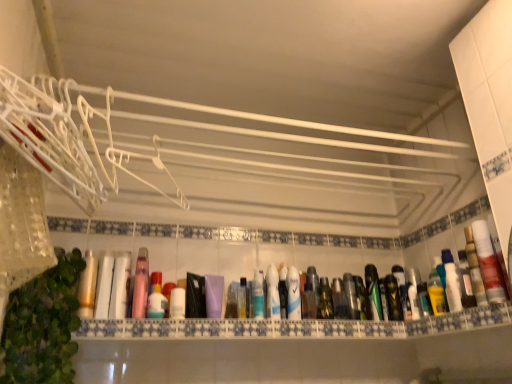
Question: Considering the positions of point (376, 274) and point (34, 317), is point (376, 274) closer or farther from the camera than point (34, 317)?

Choices:
 (A) farther
 (B) closer

Answer: (A)

Question: Relative to green leafy plant at lower left, is green matte bottle at center, which is the second mouthwash from right to left, in front or behind?

Choices:
 (A) behind
 (B) front

Answer: (A)

Question: Which object is the closest to the metallic silver spray can at center?

Choices:
 (A) white plastic bottle at right, the first mouthwash in the right-to-left sequence
 (B) blue glossy mouthwash at center, which is counted as the fifth mouthwash, starting from the right
 (C) pink glossy bottle at center, the 7th mouthwash when ordered from right to left
 (D) green leafy plant at lower left
 (E) translucent plastic bottles at center

Answer: (E)

Question: Which is farther from the translucent plastic bottles at center?

Choices:
 (A) white glossy mouthwash at center, placed as the 4th mouthwash when sorted from right to left
 (B) purple matte bottle at center, the sixth mouthwash viewed from the right
 (C) blue glossy mouthwash at center, which is counted as the fifth mouthwash, starting from the right
 (D) pink glossy bottle at center, which ranks as the 2th mouthwash in left-to-right order
 (E) green leafy plant at lower left

Answer: (D)